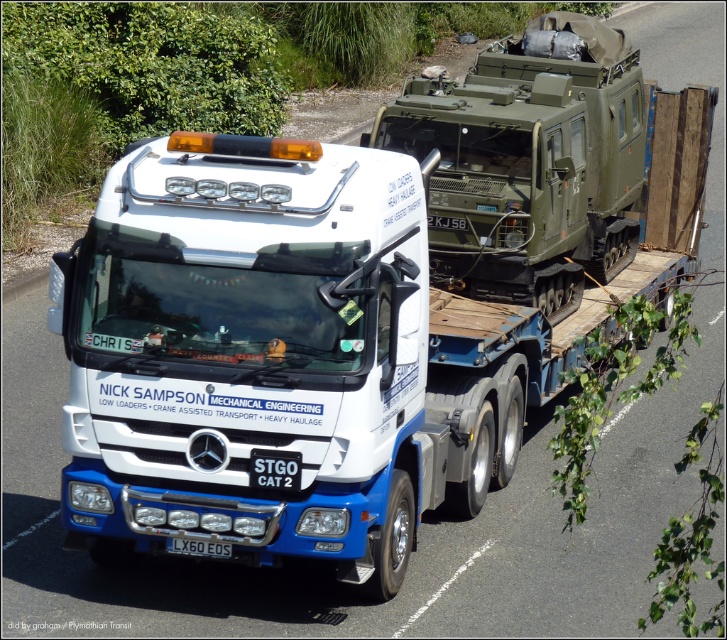
Question: Can you confirm if white matte truck at center is bigger than white plastic license plate at lower center?

Choices:
 (A) yes
 (B) no

Answer: (A)

Question: Which point is closer to the camera taking this photo?

Choices:
 (A) (209, 552)
 (B) (358, 490)

Answer: (B)

Question: Which point is farther from the camera taking this photo?

Choices:
 (A) (200, 545)
 (B) (209, 353)

Answer: (A)

Question: Does white matte truck at center appear on the right side of white plastic license plate at lower center?

Choices:
 (A) yes
 (B) no

Answer: (A)

Question: Does white matte truck at center come behind white plastic license plate at lower center?

Choices:
 (A) yes
 (B) no

Answer: (B)

Question: Which point appears farthest from the camera in this image?

Choices:
 (A) (198, 541)
 (B) (204, 193)

Answer: (A)